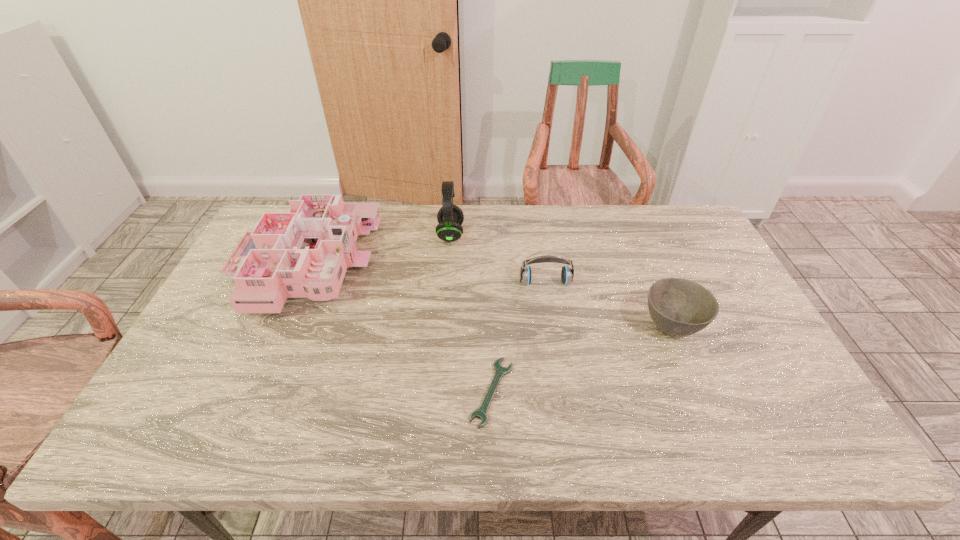
Image resolution: width=960 pixels, height=540 pixels. What are the coordinates of `vacant area in the image that satisfies the following two spatial constraints: 1. on the ear cups of the tallest object; 2. on the back side of the rightmost object` in the screenshot? It's located at (444, 325).

This screenshot has height=540, width=960. Find the location of `free region that satisfies the following two spatial constraints: 1. at the front entrance of the leftmost object; 2. on the left side of the nearest object`. free region that satisfies the following two spatial constraints: 1. at the front entrance of the leftmost object; 2. on the left side of the nearest object is located at coordinates (248, 392).